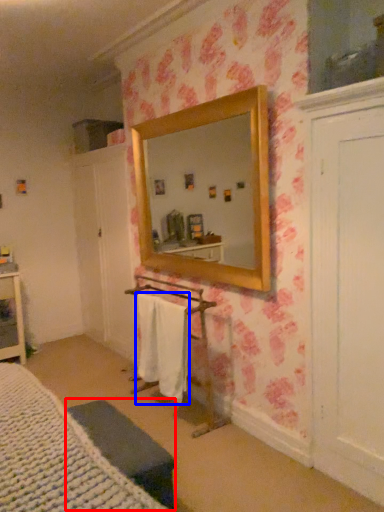
Question: Which object appears farthest to the camera in this image, furniture (highlighted by a red box) or bath towel (highlighted by a blue box)?

Choices:
 (A) furniture
 (B) bath towel

Answer: (B)